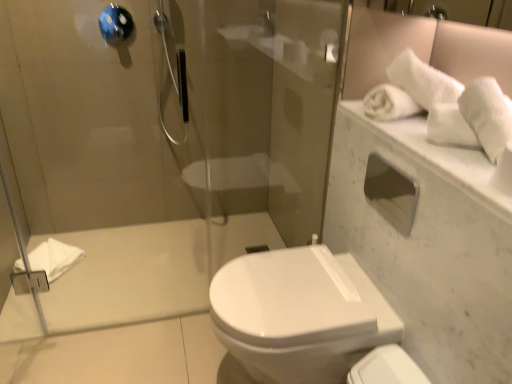
Question: Is white matte towel at left, marked as the first bath towel in a bottom-to-top arrangement, oriented away from blue glossy towel bar at upper left?

Choices:
 (A) yes
 (B) no

Answer: (B)

Question: Does white matte towel at left, the 2th bath towel in the right-to-left sequence, lie in front of blue glossy towel bar at upper left?

Choices:
 (A) yes
 (B) no

Answer: (B)

Question: Is there a large distance between white matte towel at left, marked as the 2th bath towel in a front-to-back arrangement, and blue glossy towel bar at upper left?

Choices:
 (A) no
 (B) yes

Answer: (B)

Question: Does white matte towel at left, marked as the first bath towel in a bottom-to-top arrangement, have a greater height compared to blue glossy towel bar at upper left?

Choices:
 (A) no
 (B) yes

Answer: (A)

Question: From the image's perspective, is white matte towel at left, marked as the 2th bath towel in a front-to-back arrangement, below blue glossy towel bar at upper left?

Choices:
 (A) yes
 (B) no

Answer: (A)

Question: From a real-world perspective, relative to white glossy toilet at lower right, is matte silver showerhead at upper center vertically above or below?

Choices:
 (A) above
 (B) below

Answer: (A)

Question: In terms of size, does matte silver showerhead at upper center appear bigger or smaller than white glossy toilet at lower right?

Choices:
 (A) big
 (B) small

Answer: (A)

Question: In the image, is matte silver showerhead at upper center on the left side or the right side of white glossy toilet at lower right?

Choices:
 (A) left
 (B) right

Answer: (A)

Question: From their relative heights in the image, would you say matte silver showerhead at upper center is taller or shorter than white glossy toilet at lower right?

Choices:
 (A) short
 (B) tall

Answer: (B)

Question: Considering the positions of white soft towel at upper right, arranged as the second bath towel when ordered from the bottom, and white glossy toilet at lower right in the image, is white soft towel at upper right, arranged as the second bath towel when ordered from the bottom, taller or shorter than white glossy toilet at lower right?

Choices:
 (A) tall
 (B) short

Answer: (B)

Question: In the image, is white soft towel at upper right, arranged as the 1th bath towel when viewed from the front, positioned in front of or behind white glossy toilet at lower right?

Choices:
 (A) behind
 (B) front

Answer: (B)

Question: From a real-world perspective, is white soft towel at upper right, the 2th bath towel viewed from the back, above or below white glossy toilet at lower right?

Choices:
 (A) below
 (B) above

Answer: (B)

Question: From the image's perspective, relative to white glossy toilet at lower right, is white soft towel at upper right, arranged as the 1th bath towel when viewed from the front, above or below?

Choices:
 (A) below
 (B) above

Answer: (B)

Question: Looking at their shapes, would you say white marble mirror at upper right is wider or thinner than white soft towel at upper right, arranged as the 1th bath towel when viewed from the front?

Choices:
 (A) thin
 (B) wide

Answer: (B)

Question: Would you say white marble mirror at upper right is to the left or to the right of white soft towel at upper right, which is the 1th bath towel in top-to-bottom order, in the picture?

Choices:
 (A) right
 (B) left

Answer: (B)